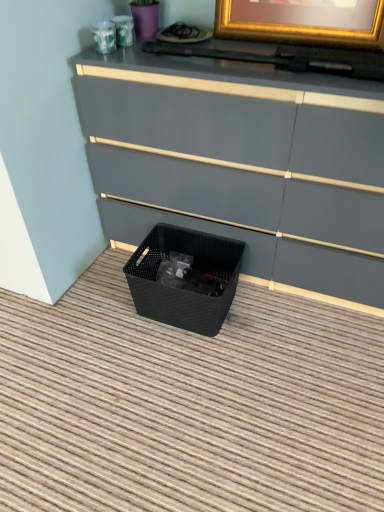
The image size is (384, 512). Find the location of `vacant space situated on the left part of black woven basket at lower center`. vacant space situated on the left part of black woven basket at lower center is located at coordinates (99, 306).